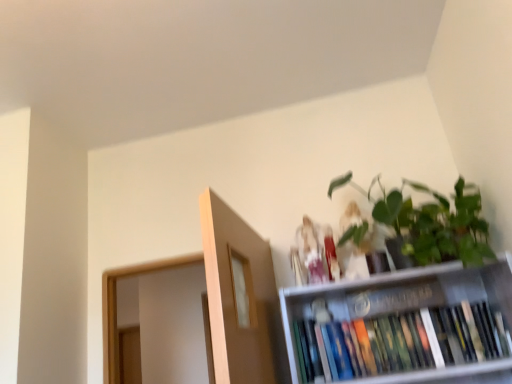
Question: Is matte white figurine at upper center, which appears as the 2th toy when viewed from the right, positioned with its back to green matte plant at upper right?

Choices:
 (A) no
 (B) yes

Answer: (A)

Question: From a real-world perspective, is matte white figurine at upper center, the 1th toy in the left-to-right sequence, positioned over green matte plant at upper right based on gravity?

Choices:
 (A) no
 (B) yes

Answer: (A)

Question: Is matte white figurine at upper center, the 1th toy in the left-to-right sequence, behind green matte plant at upper right?

Choices:
 (A) yes
 (B) no

Answer: (A)

Question: Is matte white figurine at upper center, the 1th toy in the left-to-right sequence, bigger than green matte plant at upper right?

Choices:
 (A) no
 (B) yes

Answer: (A)

Question: Is green matte plant at upper right a part of matte white figurine at upper center, the 1th toy in the left-to-right sequence?

Choices:
 (A) yes
 (B) no

Answer: (B)

Question: Does point (302, 228) appear closer or farther from the camera than point (361, 271)?

Choices:
 (A) closer
 (B) farther

Answer: (B)

Question: Considering the positions of matte white figurine at upper center, which appears as the 2th toy when viewed from the right, and matte white figurine at upper center, positioned as the first toy in right-to-left order, in the image, is matte white figurine at upper center, which appears as the 2th toy when viewed from the right, bigger or smaller than matte white figurine at upper center, positioned as the first toy in right-to-left order,?

Choices:
 (A) big
 (B) small

Answer: (B)

Question: Is matte white figurine at upper center, which appears as the 2th toy when viewed from the right, inside or outside of matte white figurine at upper center, positioned as the first toy in right-to-left order?

Choices:
 (A) inside
 (B) outside

Answer: (B)

Question: From a real-world perspective, is matte white figurine at upper center, which appears as the 2th toy when viewed from the right, physically located above or below matte white figurine at upper center, which ranks as the 2th toy in left-to-right order?

Choices:
 (A) above
 (B) below

Answer: (B)

Question: Based on their sizes in the image, would you say green matte plant at upper right is bigger or smaller than matte white figurine at upper center, which ranks as the 2th toy in left-to-right order?

Choices:
 (A) big
 (B) small

Answer: (A)

Question: From a real-world perspective, is green matte plant at upper right positioned above or below matte white figurine at upper center, positioned as the first toy in right-to-left order?

Choices:
 (A) below
 (B) above

Answer: (B)

Question: Is point (418, 226) closer or farther from the camera than point (336, 246)?

Choices:
 (A) farther
 (B) closer

Answer: (B)

Question: From the image's perspective, relative to matte white figurine at upper center, positioned as the first toy in right-to-left order, is green matte plant at upper right above or below?

Choices:
 (A) below
 (B) above

Answer: (B)

Question: From a real-world perspective, is hardcover books at upper right physically located above or below matte white figurine at upper center, which appears as the 2th toy when viewed from the right?

Choices:
 (A) below
 (B) above

Answer: (A)

Question: In the image, is hardcover books at upper right positioned in front of or behind matte white figurine at upper center, the 1th toy in the left-to-right sequence?

Choices:
 (A) front
 (B) behind

Answer: (A)